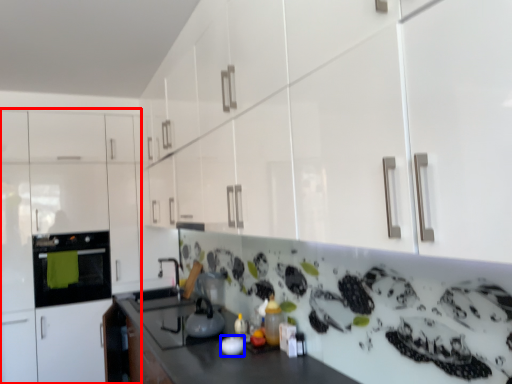
Question: Among these objects, which one is farthest to the camera, cabinetry (highlighted by a red box) or appliance (highlighted by a blue box)?

Choices:
 (A) cabinetry
 (B) appliance

Answer: (A)